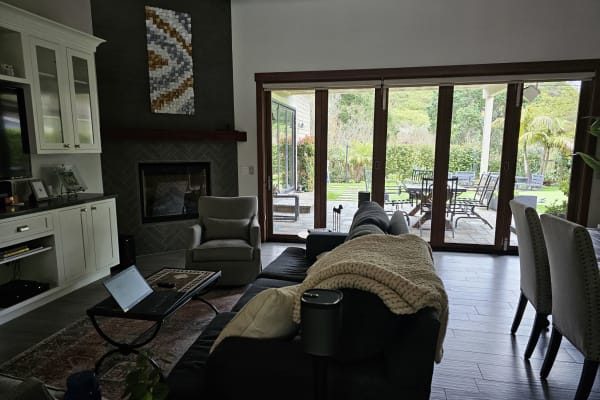
The width and height of the screenshot is (600, 400). What are the coordinates of `laptop` in the screenshot? It's located at (126, 292).